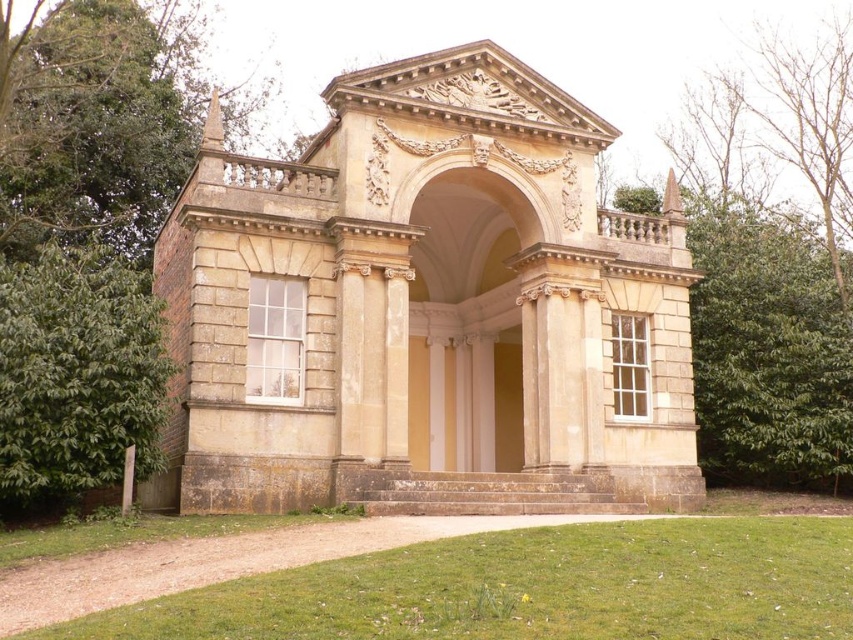
Can you confirm if green leafy tree at upper left is shorter than green leafy tree at left?

In fact, green leafy tree at upper left may be taller than green leafy tree at left.

From the picture: Does green leafy tree at upper left appear on the right side of green leafy tree at left?

No, green leafy tree at upper left is not to the right of green leafy tree at left.

Does point (178, 100) come behind point (114, 378)?

Yes, point (178, 100) is farther from viewer.

Identify the location of green leafy tree at upper left. (x=99, y=122).